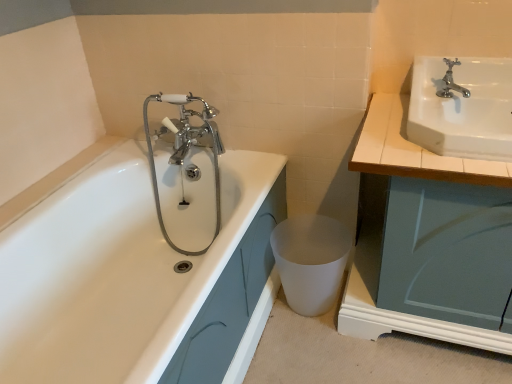
Question: From the image's perspective, is white glossy sink at upper right below polished chrome faucet at upper right?

Choices:
 (A) no
 (B) yes

Answer: (B)

Question: Is the surface of white glossy sink at upper right in direct contact with polished chrome faucet at upper right?

Choices:
 (A) no
 (B) yes

Answer: (A)

Question: Is white glossy sink at upper right to the right of polished chrome faucet at upper right from the viewer's perspective?

Choices:
 (A) no
 (B) yes

Answer: (B)

Question: Considering the relative sizes of white glossy sink at upper right and polished chrome faucet at upper right in the image provided, is white glossy sink at upper right thinner than polished chrome faucet at upper right?

Choices:
 (A) no
 (B) yes

Answer: (A)

Question: From a real-world perspective, is white glossy sink at upper right under polished chrome faucet at upper right?

Choices:
 (A) no
 (B) yes

Answer: (B)

Question: From the image's perspective, is white glossy sink at upper right above or below white glossy bathtub at left?

Choices:
 (A) below
 (B) above

Answer: (B)

Question: In terms of width, does white glossy sink at upper right look wider or thinner when compared to white glossy bathtub at left?

Choices:
 (A) wide
 (B) thin

Answer: (B)

Question: Is white glossy sink at upper right situated inside white glossy bathtub at left or outside?

Choices:
 (A) inside
 (B) outside

Answer: (B)

Question: In the image, is white glossy sink at upper right on the left side or the right side of white glossy bathtub at left?

Choices:
 (A) right
 (B) left

Answer: (A)

Question: From a real-world perspective, relative to white glossy cabinet at right, is white matte toilet bowl at lower center vertically above or below?

Choices:
 (A) below
 (B) above

Answer: (A)

Question: From the image's perspective, is white matte toilet bowl at lower center located above or below white glossy cabinet at right?

Choices:
 (A) above
 (B) below

Answer: (B)

Question: Considering the positions of point [310, 302] and point [484, 162], is point [310, 302] closer or farther from the camera than point [484, 162]?

Choices:
 (A) farther
 (B) closer

Answer: (A)

Question: Choose the correct answer: Is white matte toilet bowl at lower center inside white glossy cabinet at right or outside it?

Choices:
 (A) outside
 (B) inside

Answer: (A)

Question: In terms of width, does white glossy cabinet at right look wider or thinner when compared to white matte toilet bowl at lower center?

Choices:
 (A) thin
 (B) wide

Answer: (B)

Question: In terms of size, does white glossy cabinet at right appear bigger or smaller than white matte toilet bowl at lower center?

Choices:
 (A) small
 (B) big

Answer: (B)